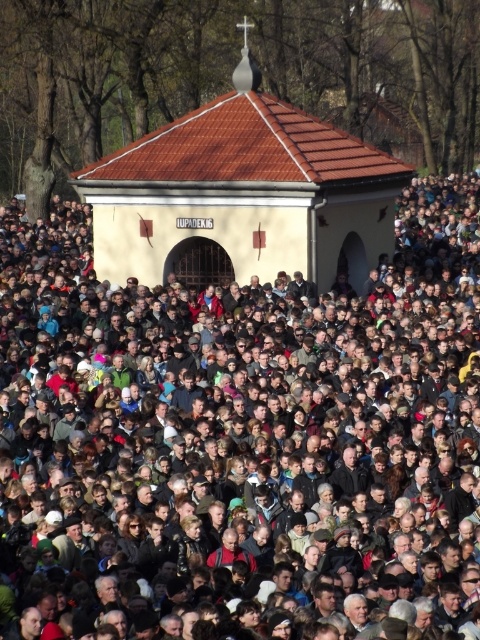
Does brown textured building at center appear on the right side of beige stucco chapel at center?

In fact, brown textured building at center is to the left of beige stucco chapel at center.

Is point (262, 321) farther from viewer compared to point (384, 250)?

No.

Identify the location of brown textured building at center. Image resolution: width=480 pixels, height=640 pixels. (242, 428).